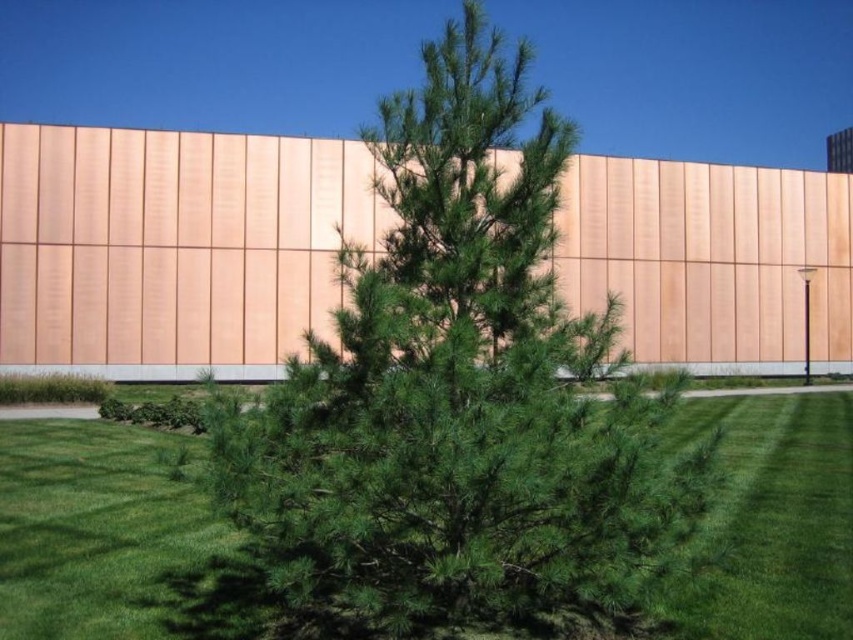
Question: Can you confirm if green needle-like at center is thinner than green grass at center?

Choices:
 (A) yes
 (B) no

Answer: (A)

Question: Does green needle-like at center have a smaller size compared to green grass at center?

Choices:
 (A) yes
 (B) no

Answer: (B)

Question: Which point is farther to the camera?

Choices:
 (A) (399, 205)
 (B) (769, 433)

Answer: (B)

Question: Which object appears farthest from the camera in this image?

Choices:
 (A) green needle-like at center
 (B) green grass at center

Answer: (B)

Question: Does green needle-like at center lie in front of green grass at center?

Choices:
 (A) yes
 (B) no

Answer: (A)